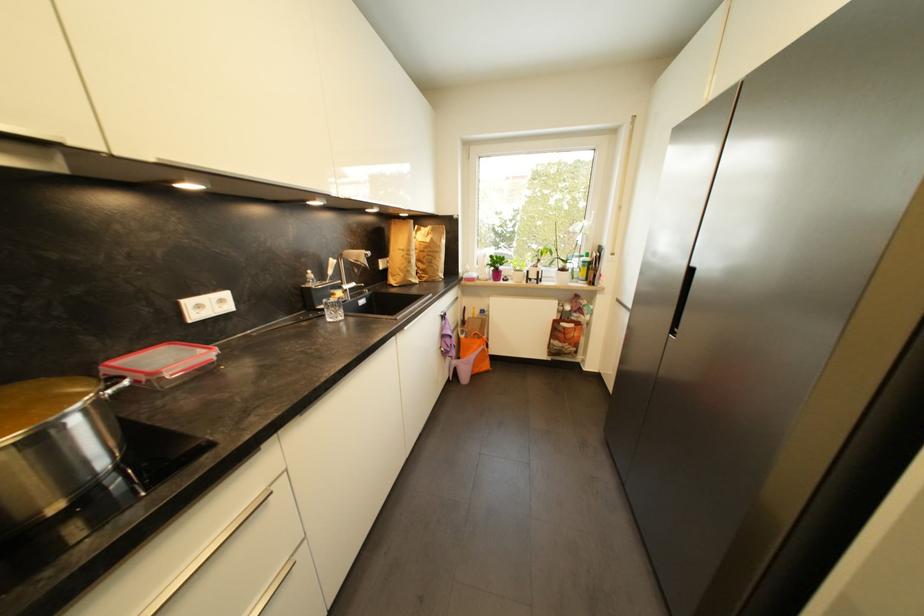
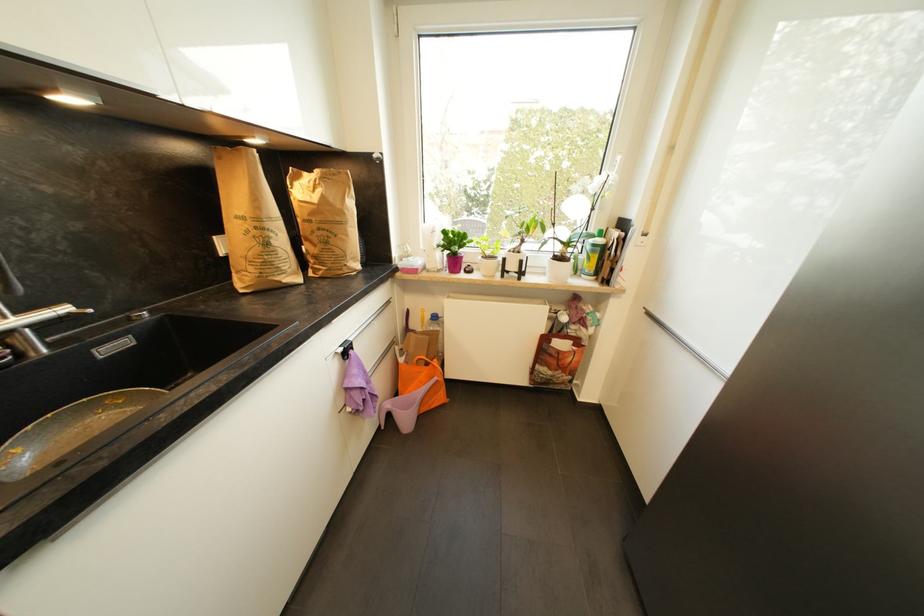
Question: The images are taken continuously from a first-person perspective. In which direction is your viewpoint rotating?

Choices:
 (A) Left
 (B) Right
 (C) Up
 (D) Down

Answer: (D)